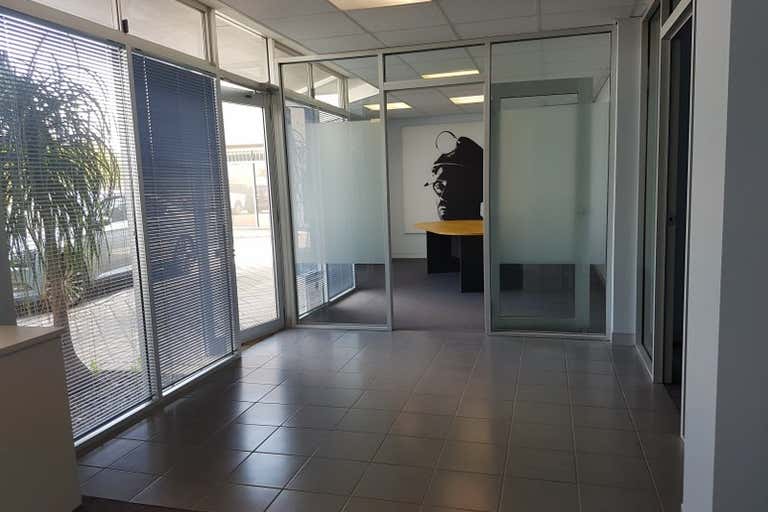
The height and width of the screenshot is (512, 768). What are the coordinates of `recessed lighting in ceiling` in the screenshot? It's located at (389, 109), (472, 99), (439, 76), (361, 6).